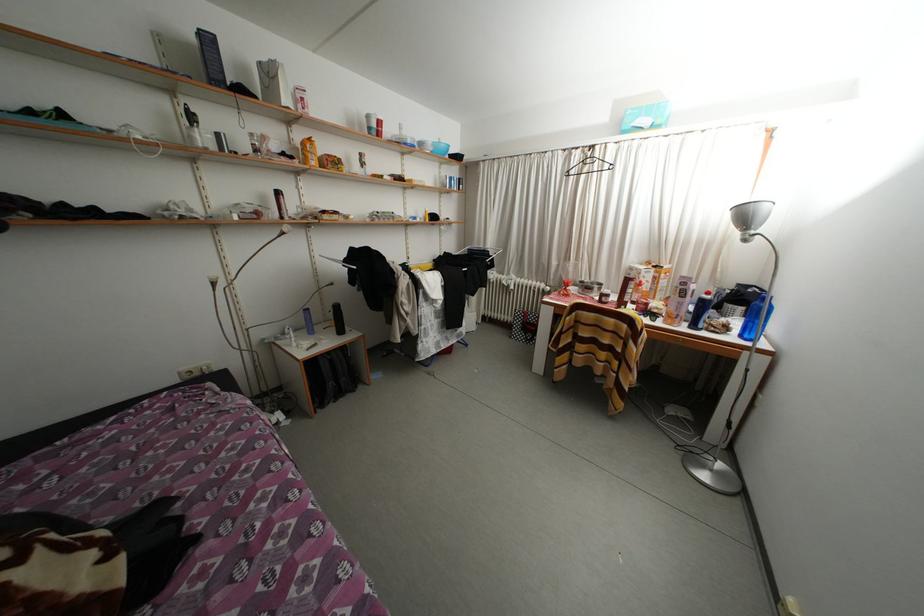
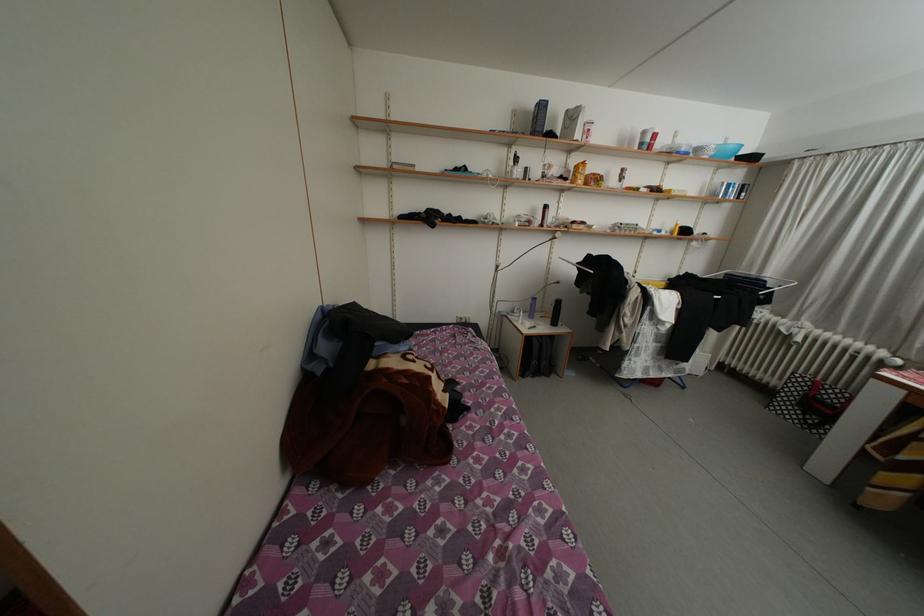
In the second image, find the point that corresponds to (276,78) in the first image.

(580, 122)